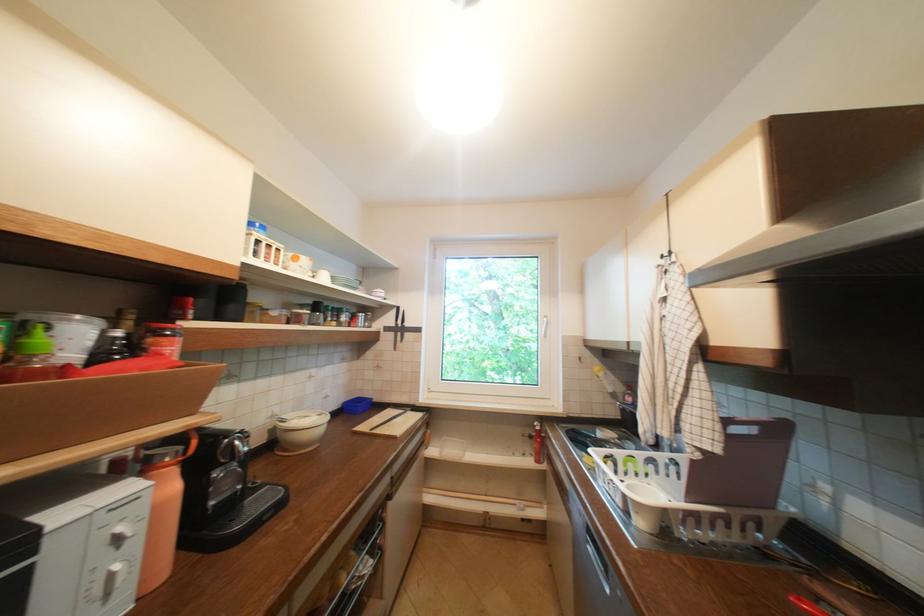
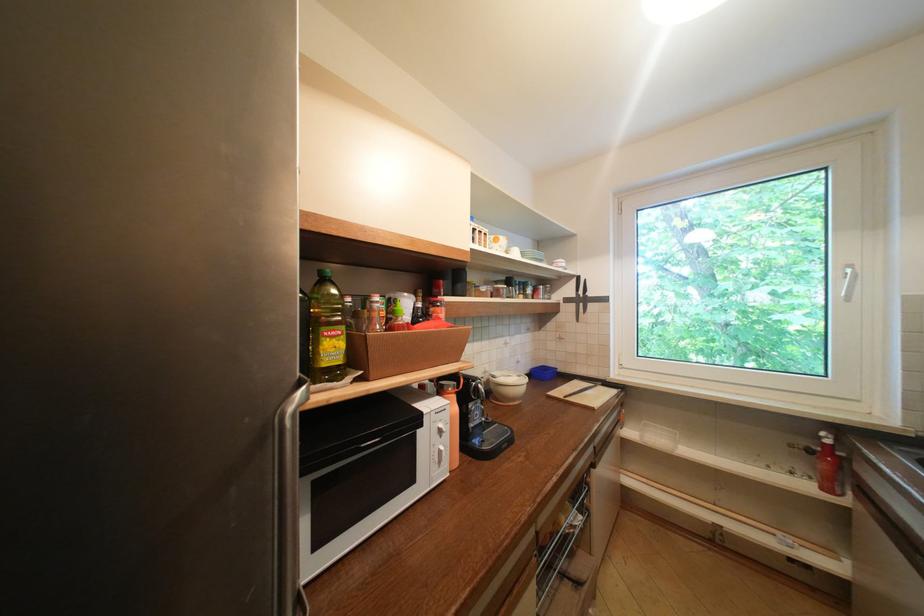
In the second image, find the point that corresponds to (368,429) in the first image.

(561, 394)